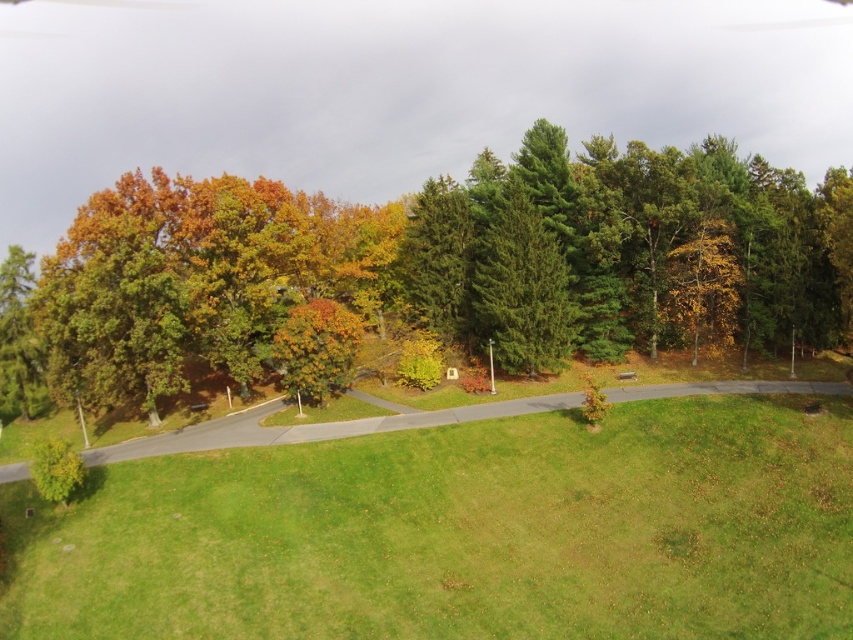
Which of these two, green grassy field at center or green matte tree at center, stands taller?

green matte tree at center is taller.

Measure the distance between point (608, 554) and camera.

The distance of point (608, 554) from camera is 23.68 meters.

Identify the location of green grassy field at center. (461, 532).